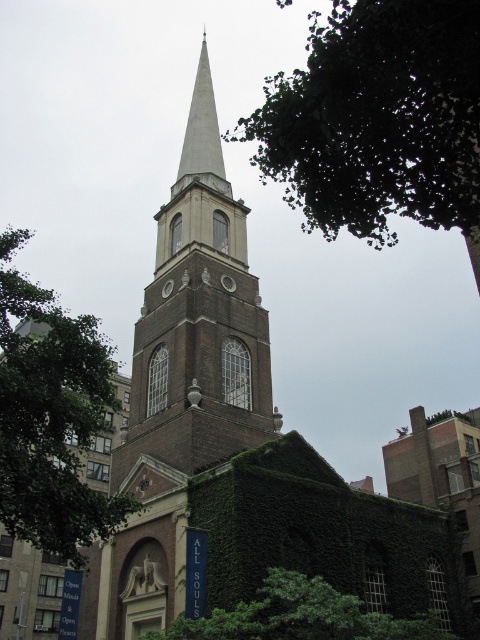
Is green leafy tree at upper center shorter than brown brick tower at center?

Indeed, green leafy tree at upper center has a lesser height compared to brown brick tower at center.

Is point (432, 22) positioned before point (166, 212)?

Yes, it is.

Is point (408, 106) closer to camera compared to point (180, 221)?

Yes, point (408, 106) is closer to viewer.

What are the coordinates of `green leafy tree at upper center` in the screenshot? It's located at (377, 120).

From the picture: Is green leafy tree at upper center to the left of green leafy tree at left from the viewer's perspective?

In fact, green leafy tree at upper center is to the right of green leafy tree at left.

Can you confirm if green leafy tree at upper center is taller than green leafy tree at left?

Yes, green leafy tree at upper center is taller than green leafy tree at left.

Which is in front, point (424, 161) or point (44, 346)?

Point (424, 161) is more forward.

Locate an element on the screen. Image resolution: width=480 pixels, height=640 pixels. green leafy tree at upper center is located at coordinates (377, 120).

Can you confirm if green leafy tree at left is taller than green ivy-covered wall at lower center?

Yes, green leafy tree at left is taller than green ivy-covered wall at lower center.

From the picture: Is green leafy tree at left to the right of green ivy-covered wall at lower center from the viewer's perspective?

Incorrect, green leafy tree at left is not on the right side of green ivy-covered wall at lower center.

Does point (0, 333) come farther from viewer compared to point (347, 636)?

No.

Locate an element on the screen. green leafy tree at left is located at coordinates (50, 417).